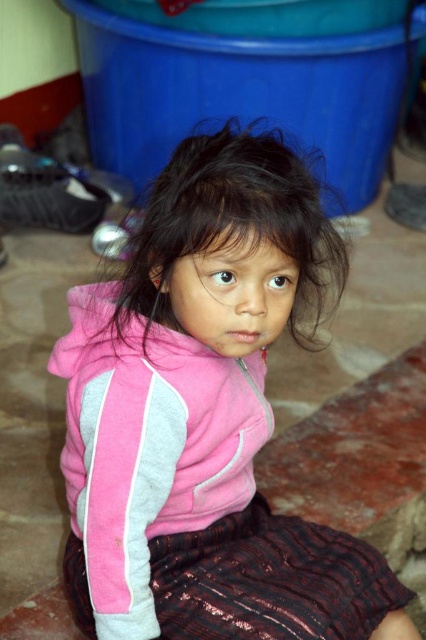
You are a photographer adjusting your camera to focus on two points in the image. The first point is at coordinates point (282, 216) and the second is at point (296, 298). Which point should you focus on first if you want to capture the closest object to the camera?

Point (282, 216) is closer to the viewer than point (296, 298), so you should focus on point (282, 216) first to capture the closest object to the camera.

You are a photographer setting up for a portrait. You notice the pink fabric at center and the dark brown silky hair at center in your frame. Which object should you focus on first to ensure it is sharp in the final photo?

You should focus on the pink fabric at center first because it is closer to the viewer than the dark brown silky hair at center, so focusing on the closer object ensures sharpness in the foreground.